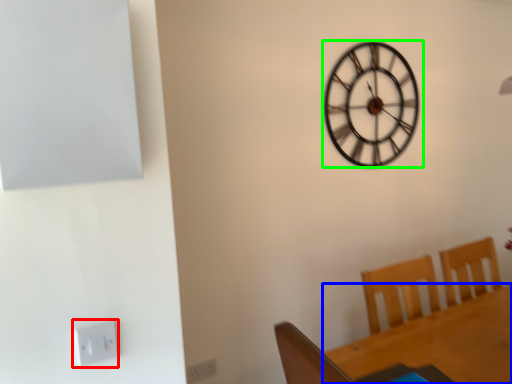
Question: Which object is the closest to the electric outlet (highlighted by a red box)? Choose among these: round table (highlighted by a blue box) or wall clock (highlighted by a green box).

Choices:
 (A) round table
 (B) wall clock

Answer: (A)